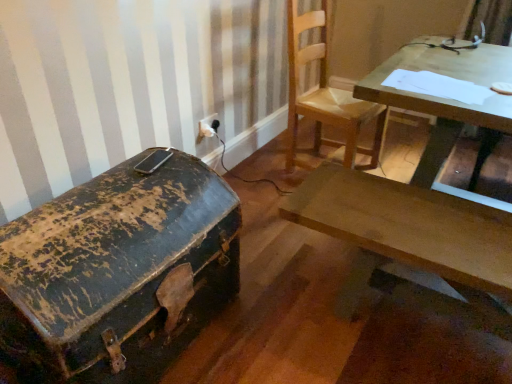
Question: From the image's perspective, is white plastic electric outlet at upper center above wooden table at upper right?

Choices:
 (A) yes
 (B) no

Answer: (A)

Question: Can you confirm if white plastic electric outlet at upper center is taller than wooden table at upper right?

Choices:
 (A) no
 (B) yes

Answer: (A)

Question: From a real-world perspective, is white plastic electric outlet at upper center under wooden table at upper right?

Choices:
 (A) no
 (B) yes

Answer: (B)

Question: Does white plastic electric outlet at upper center have a greater width compared to wooden table at upper right?

Choices:
 (A) no
 (B) yes

Answer: (A)

Question: From the image's perspective, is white plastic electric outlet at upper center below wooden table at upper right?

Choices:
 (A) no
 (B) yes

Answer: (A)

Question: Is white plastic electric outlet at upper center in front of or behind wooden desk at center in the image?

Choices:
 (A) behind
 (B) front

Answer: (A)

Question: Is white plastic electric outlet at upper center inside the boundaries of wooden desk at center, or outside?

Choices:
 (A) outside
 (B) inside

Answer: (A)

Question: Based on their positions, is white plastic electric outlet at upper center located to the left or right of wooden desk at center?

Choices:
 (A) right
 (B) left

Answer: (B)

Question: From the image's perspective, relative to wooden desk at center, is white plastic electric outlet at upper center above or below?

Choices:
 (A) above
 (B) below

Answer: (A)

Question: Choose the correct answer: Is wooden chair at upper center inside wooden desk at center or outside it?

Choices:
 (A) inside
 (B) outside

Answer: (B)

Question: Relative to wooden desk at center, is wooden chair at upper center in front or behind?

Choices:
 (A) front
 (B) behind

Answer: (B)

Question: Looking at the image, does wooden chair at upper center seem bigger or smaller compared to wooden desk at center?

Choices:
 (A) big
 (B) small

Answer: (A)

Question: From the image's perspective, is wooden chair at upper center located above or below wooden desk at center?

Choices:
 (A) above
 (B) below

Answer: (A)

Question: Considering the positions of point (44, 296) and point (218, 122), is point (44, 296) closer or farther from the camera than point (218, 122)?

Choices:
 (A) farther
 (B) closer

Answer: (B)

Question: Visually, is rusty metal trunk at left positioned to the left or to the right of white plastic electric outlet at upper center?

Choices:
 (A) left
 (B) right

Answer: (A)